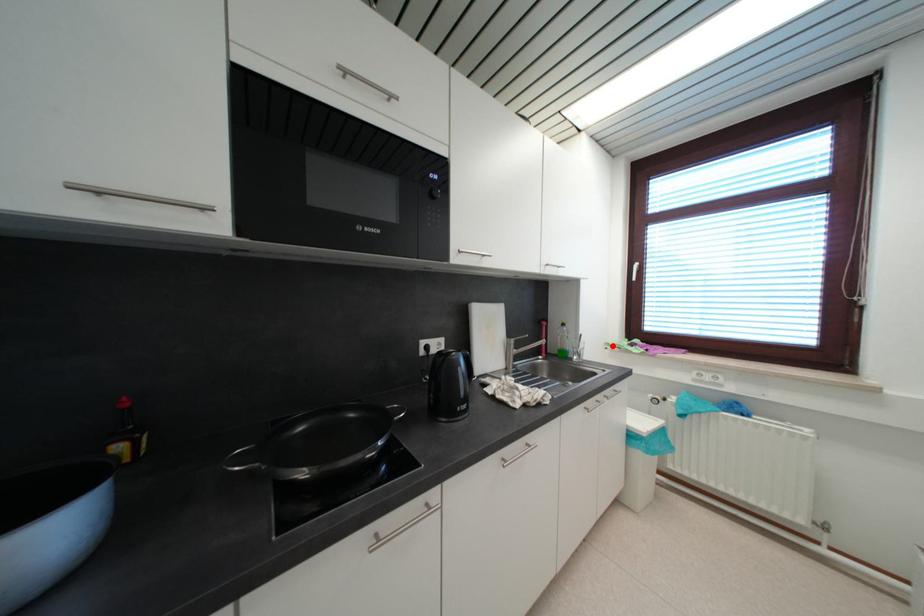
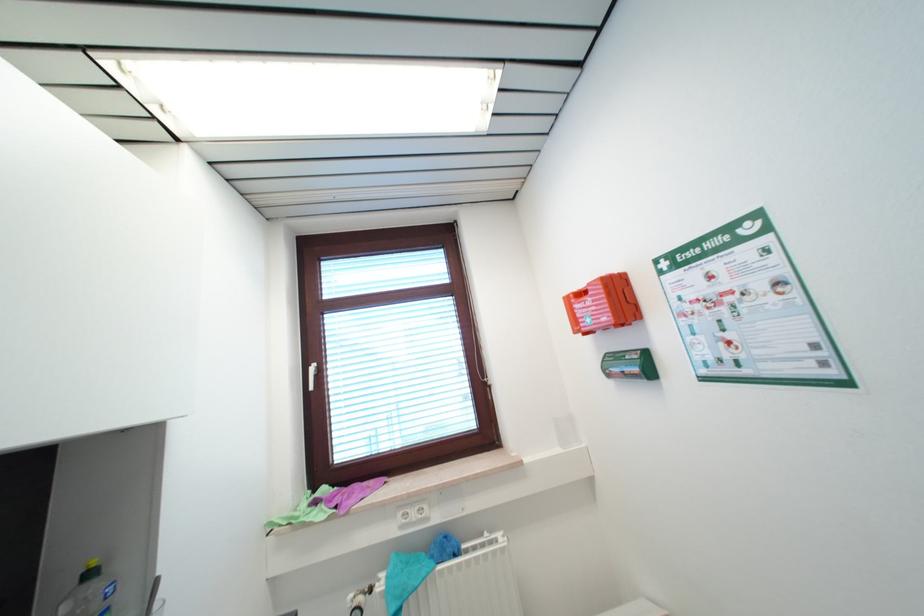
Question: I am providing you with two images of the same scene from different viewpoints. Given a red point in image1, look at the same physical point in image2. Is it:

Choices:
 (A) Closer to the viewpoint
 (B) Farther from the viewpoint

Answer: (A)